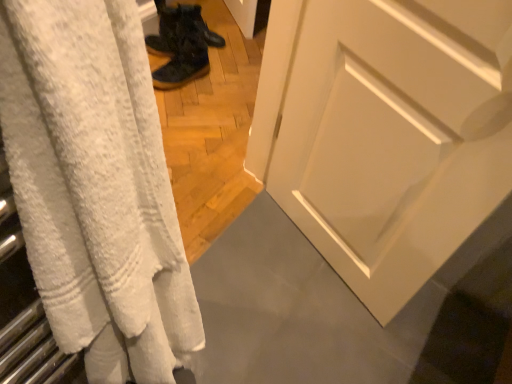
Question: Is there a large distance between camouflage fabric boots at center, the second footwear when ordered from back to front, and dark matte boots at center, placed as the 2th footwear when sorted from front to back?

Choices:
 (A) yes
 (B) no

Answer: (B)

Question: Is camouflage fabric boots at center, marked as the first footwear in a front-to-back arrangement, at the right side of dark matte boots at center, placed as the 2th footwear when sorted from front to back?

Choices:
 (A) no
 (B) yes

Answer: (A)

Question: Does camouflage fabric boots at center, marked as the first footwear in a front-to-back arrangement, have a greater width compared to dark matte boots at center, which is the 1th footwear from back to front?

Choices:
 (A) no
 (B) yes

Answer: (B)

Question: Does camouflage fabric boots at center, the second footwear when ordered from back to front, have a larger size compared to dark matte boots at center, which is the 1th footwear from back to front?

Choices:
 (A) yes
 (B) no

Answer: (A)

Question: Is camouflage fabric boots at center, the second footwear when ordered from back to front, oriented away from dark matte boots at center, which is the 1th footwear from back to front?

Choices:
 (A) no
 (B) yes

Answer: (A)

Question: Is camouflage fabric boots at center, marked as the first footwear in a front-to-back arrangement, facing towards dark matte boots at center, placed as the 2th footwear when sorted from front to back?

Choices:
 (A) no
 (B) yes

Answer: (A)

Question: Does white textured towel at left have a larger size compared to camouflage fabric boots at center, the second footwear when ordered from back to front?

Choices:
 (A) no
 (B) yes

Answer: (B)

Question: Considering the relative positions of white textured towel at left and camouflage fabric boots at center, marked as the first footwear in a front-to-back arrangement, in the image provided, is white textured towel at left behind camouflage fabric boots at center, marked as the first footwear in a front-to-back arrangement,?

Choices:
 (A) no
 (B) yes

Answer: (A)

Question: Is white textured towel at left located outside camouflage fabric boots at center, the second footwear when ordered from back to front?

Choices:
 (A) yes
 (B) no

Answer: (A)

Question: Does white textured towel at left turn towards camouflage fabric boots at center, the second footwear when ordered from back to front?

Choices:
 (A) no
 (B) yes

Answer: (A)

Question: Does white textured towel at left have a lesser width compared to camouflage fabric boots at center, marked as the first footwear in a front-to-back arrangement?

Choices:
 (A) no
 (B) yes

Answer: (B)

Question: Considering the relative sizes of white textured towel at left and camouflage fabric boots at center, marked as the first footwear in a front-to-back arrangement, in the image provided, is white textured towel at left taller than camouflage fabric boots at center, marked as the first footwear in a front-to-back arrangement,?

Choices:
 (A) yes
 (B) no

Answer: (A)

Question: Can you confirm if dark matte boots at center, placed as the 2th footwear when sorted from front to back, is thinner than camouflage fabric boots at center, the second footwear when ordered from back to front?

Choices:
 (A) no
 (B) yes

Answer: (B)